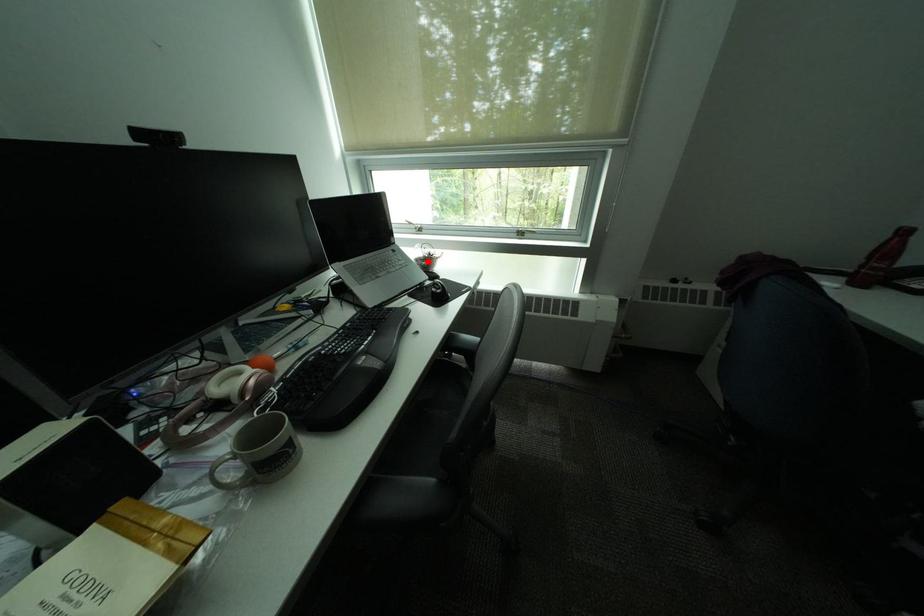
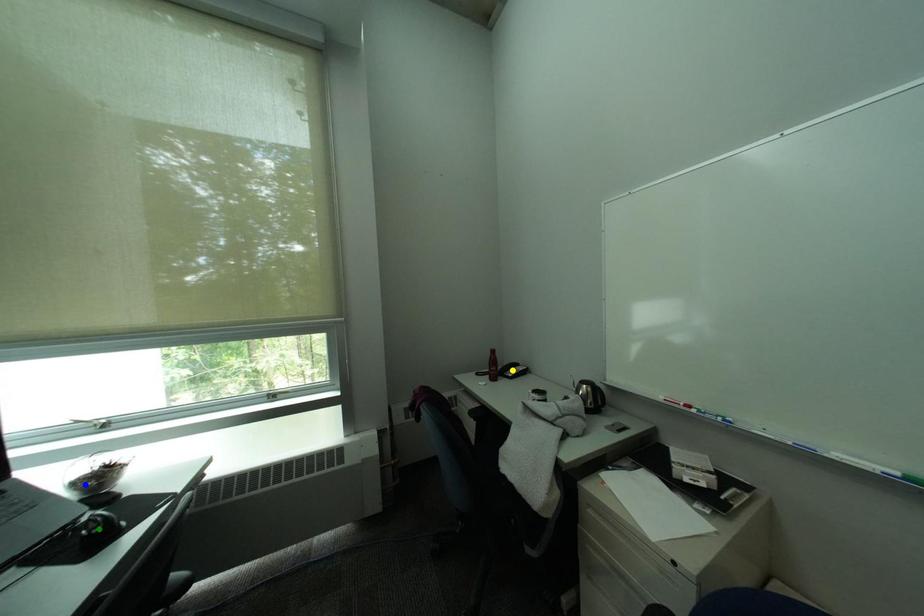
Question: I am providing you with two images of the same scene from different viewpoints. A red point is marked on the first image. You are given multiple points on the second image. Which point in image 2 is actually the same real-world point as the red point in image 1?

Choices:
 (A) yellow point
 (B) blue point
 (C) green point

Answer: (B)